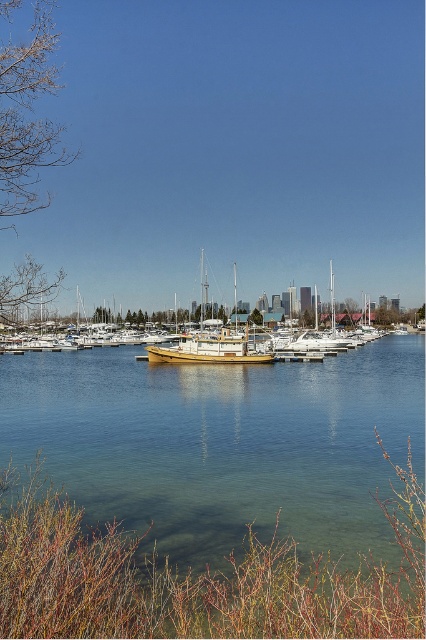
Question: Estimate the real-world distances between objects in this image. Which object is closer to the wooden boat at center?

Choices:
 (A) clear water at center
 (B) wooden sailboat at center

Answer: (B)

Question: Which object appears closest to the camera in this image?

Choices:
 (A) wooden sailboat at center
 (B) clear water at center
 (C) wooden boat at center

Answer: (B)

Question: Is wooden boat at center bigger than wooden sailboat at center?

Choices:
 (A) yes
 (B) no

Answer: (A)

Question: Where is clear water at center located in relation to wooden boat at center in the image?

Choices:
 (A) left
 (B) right

Answer: (A)

Question: Which point is closer to the camera?

Choices:
 (A) wooden sailboat at center
 (B) clear water at center
 (C) wooden boat at center

Answer: (B)

Question: Is wooden boat at center positioned in front of wooden sailboat at center?

Choices:
 (A) yes
 (B) no

Answer: (A)